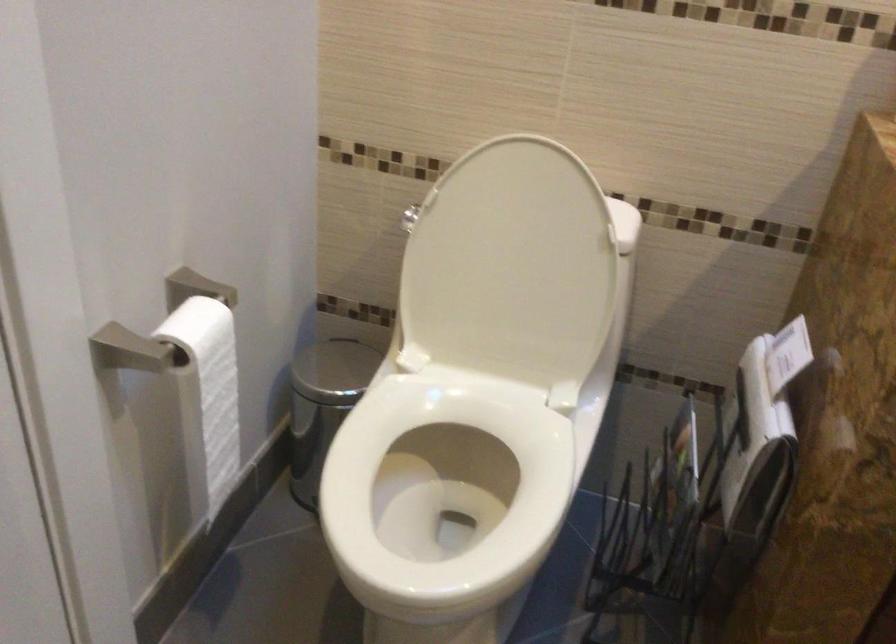
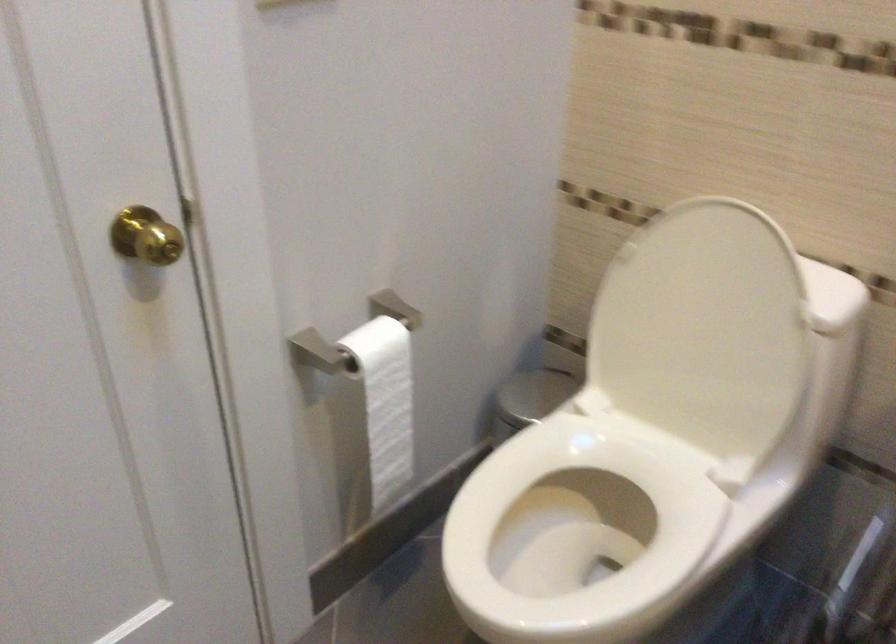
Question: What movement of the cameraman would produce the second image?

Choices:
 (A) Left
 (B) Right
 (C) Forward
 (D) Backward

Answer: (B)